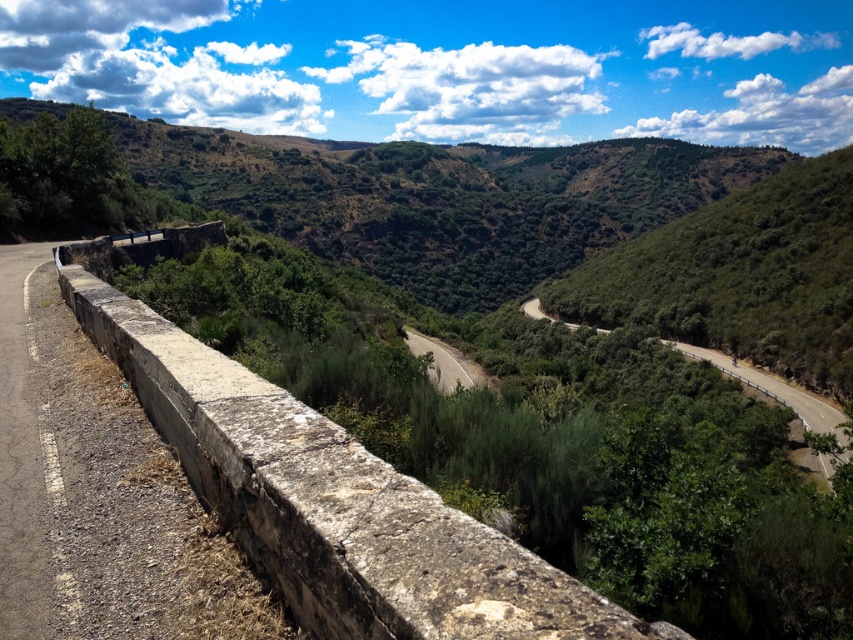
You are a hiker standing on the green leafy mountain at upper center and want to reach the asphalt road at center. Which direction should you head to get there?

The green leafy mountain at upper center is positioned on the left side of asphalt road at center, so you should head to the right to reach the asphalt road at center.

You are a hiker standing on the asphalt road at center looking towards the green leafy mountain at upper center. Which direction should you walk to get closer to the mountain?

The green leafy mountain at upper center is located above the asphalt road at center, so you should walk forward along the asphalt road at center towards the direction of the mountain.

You are a hiker planning to hike from the green grassy hill at upper center to the green leafy mountain at upper center. Given that you can walk 3 feet per second, how many seconds will it take you to reach the mountain if you walk directly towards it?

The distance between the green grassy hill at upper center and the green leafy mountain at upper center is 793.41 feet. At a walking speed of 3 feet per second, it would take 793.41 divided by 3, which equals approximately 264.47 seconds to reach the mountain.